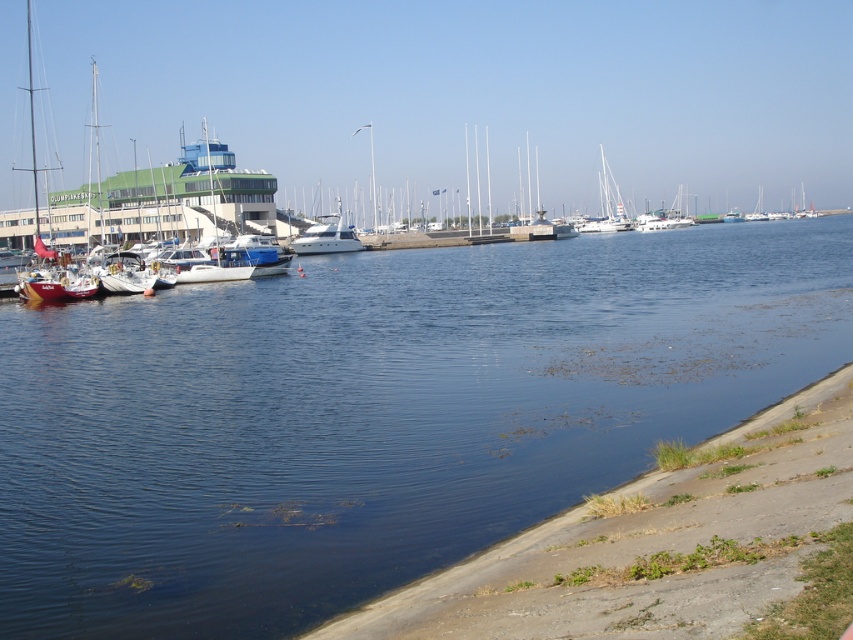
Question: Does blue water at center come behind white glossy sailboat at center?

Choices:
 (A) no
 (B) yes

Answer: (A)

Question: Which of the following is the farthest from the observer?

Choices:
 (A) smooth concrete shoreline at lower right
 (B) blue water at center
 (C) matte white sailboat at left

Answer: (C)

Question: In this image, where is matte white sailboat at left located relative to white glossy sailboat at center?

Choices:
 (A) above
 (B) below

Answer: (A)

Question: Is the position of matte white sailboat at left less distant than that of white glossy yacht at center?

Choices:
 (A) yes
 (B) no

Answer: (B)

Question: Which of the following is the farthest from the observer?

Choices:
 (A) (769, 588)
 (B) (585, 228)
 (C) (486, 12)
 (D) (126, 330)

Answer: (C)

Question: Which object appears closest to the camera in this image?

Choices:
 (A) blue water at center
 (B) white glossy yacht at center
 (C) white glossy sailboat at center

Answer: (A)